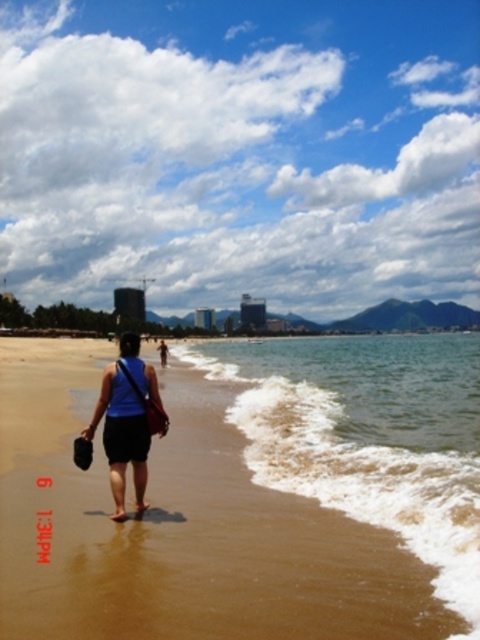
You are standing at the beach and want to reach a specific point marked at coordinates point (x=309, y=474). If your walking speed is 3 feet per second, how many seconds will it take you to reach that point?

The distance of point (x=309, y=474) from viewer is 27.56 feet. At a speed of 3 feet per second, it will take 27.56 divided by 3, which is approximately 9.19 seconds to reach the point.

You are a drone operator trying to capture a photo of the beach scene. The drone is currently at the center of the image. To get a clear shot of the brown sandy water at lower right, should you move the drone to the right or left? Please explain your reasoning based on the coordinates provided.

The brown sandy water at lower right is located at coordinates point (370, 436). Since the drone is at the center, moving it to the right would align it with the lower right area of the image, making it easier to capture the brown sandy water at lower right in the desired frame.